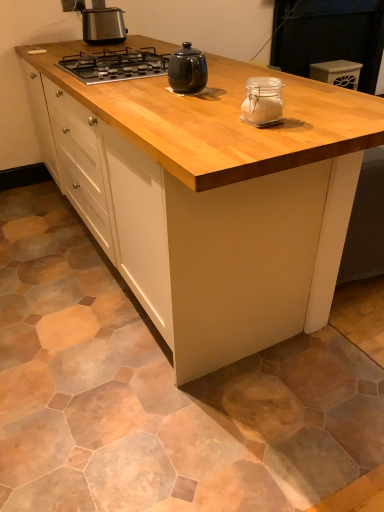
Where is `vacant area that is in front of clear glass jar at center, marked as the 1th kitchen appliance in a bottom-to-top arrangement`? vacant area that is in front of clear glass jar at center, marked as the 1th kitchen appliance in a bottom-to-top arrangement is located at coordinates (271, 138).